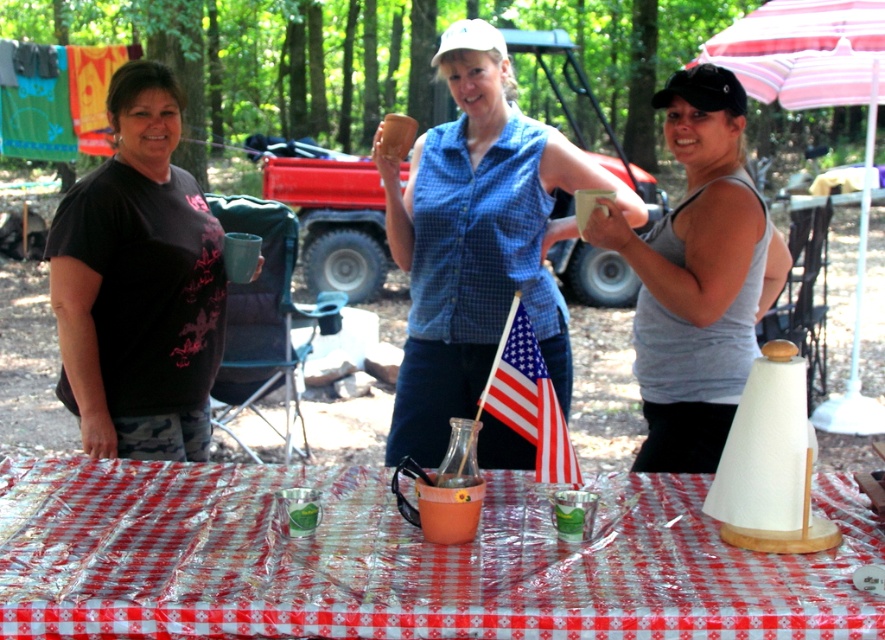
Question: Can you confirm if red checkered plastic at center is positioned above american flag at center?

Choices:
 (A) no
 (B) yes

Answer: (A)

Question: Which of these objects is positioned closest to the american flag at center?

Choices:
 (A) pink striped fabric umbrella at upper right
 (B) blue checkered shirt at center
 (C) red checkered plastic at center
 (D) gray tank top at right

Answer: (C)

Question: Among these points, which one is farthest from the camera?

Choices:
 (A) (239, 577)
 (B) (857, 70)
 (C) (536, 412)
 (D) (178, 362)

Answer: (B)

Question: Is black matte t-shirt at left in front of gray tank top at right?

Choices:
 (A) no
 (B) yes

Answer: (A)

Question: Which point appears closest to the camera in this image?

Choices:
 (A) (147, 328)
 (B) (499, 125)
 (C) (543, 426)
 (D) (633, 339)

Answer: (C)

Question: Can you confirm if blue checkered shirt at center is smaller than american flag at center?

Choices:
 (A) no
 (B) yes

Answer: (A)